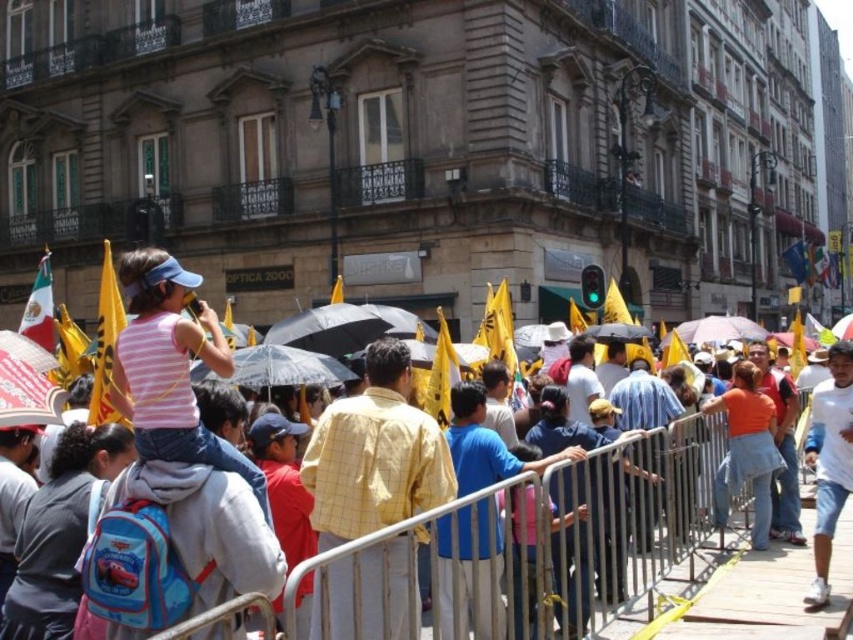
You are a photographer standing at the point marked as point (x=374, y=454) in the image. You want to take a picture of the crowd holding yellow flags. Where should you position yourself to capture the yellow checkered shirt at center and the yellow flags in the scene?

Since point (x=374, y=454) corresponds to the yellow checkered shirt at center, you should position yourself at that point to capture both the yellow checkered shirt at center and the yellow flags held by the crowd in the scene.

You are a photographer trying to capture the scene of the crowd holding flags. You notice two yellow items in the frame. Which one is positioned to the right of the other? The items are the yellow checkered shirt at center and the yellow fabric flag at upper left.

The yellow checkered shirt at center is positioned to the right of the yellow fabric flag at upper left.